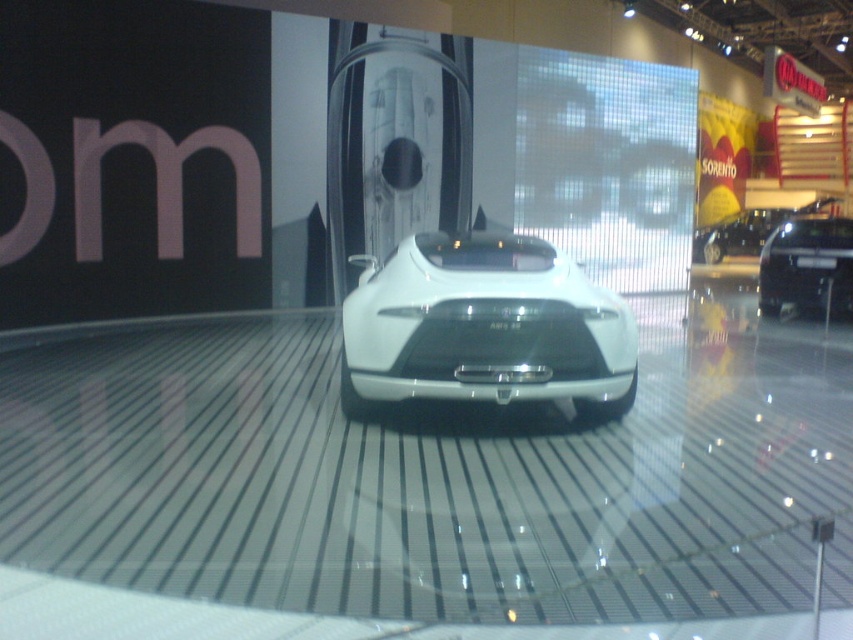
Is white glossy sports car at center taller than satin black car at center?

Correct, white glossy sports car at center is much taller as satin black car at center.

Between white glossy sports car at center and satin black car at center, which one is positioned lower?

white glossy sports car at center is below.

Which is in front, point (408, 390) or point (695, 252)?

Point (408, 390) is more forward.

Find the location of a particular element. The width and height of the screenshot is (853, 640). white glossy sports car at center is located at coordinates [485, 326].

Does black glossy car at center have a lesser height compared to satin black car at center?

No.

Which is in front, point (840, 220) or point (750, 230)?

Point (840, 220) is in front.

The height and width of the screenshot is (640, 853). I want to click on black glossy car at center, so click(807, 266).

Is point (577, 348) less distant than point (815, 244)?

Yes, it is in front of point (815, 244).

Is white glossy sports car at center shorter than black glossy car at center?

Correct, white glossy sports car at center is not as tall as black glossy car at center.

Which is in front, point (514, 292) or point (784, 268)?

Point (514, 292)

Where is `white glossy sports car at center`? The width and height of the screenshot is (853, 640). white glossy sports car at center is located at coordinates (485, 326).